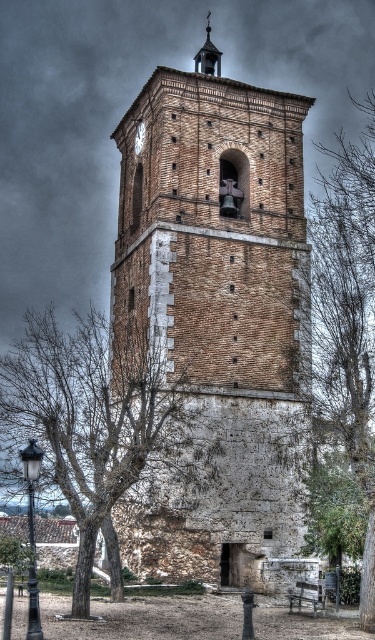
Based on the photo, who is taller, bare branches at center or green leafy tree at right?

green leafy tree at right

Is point (91, 321) less distant than point (346, 170)?

No.

You are a GUI agent. You are given a task and a screenshot of the screen. Output one action in this format:
    pyautogui.click(x=<x>, y=<y>)
    Task: Click on the bare branches at center
    
    Given the screenshot: What is the action you would take?
    pyautogui.click(x=91, y=416)

Between point (69, 412) and point (139, 124), which one is positioned behind?

The point (139, 124) is behind.

Is bare branches at center shorter than metallic clock at upper center?

No.

Where is `bare branches at center`? The width and height of the screenshot is (375, 640). bare branches at center is located at coordinates (91, 416).

This screenshot has width=375, height=640. In order to click on bare branches at center in this screenshot , I will do `click(91, 416)`.

Who is positioned more to the right, green leafy tree at right or metallic clock at upper center?

green leafy tree at right is more to the right.

At what (x,y) coordinates should I click in order to perform the action: click on green leafy tree at right. Please return your answer as a coordinate pair (x, y). This screenshot has width=375, height=640. Looking at the image, I should click on (349, 316).